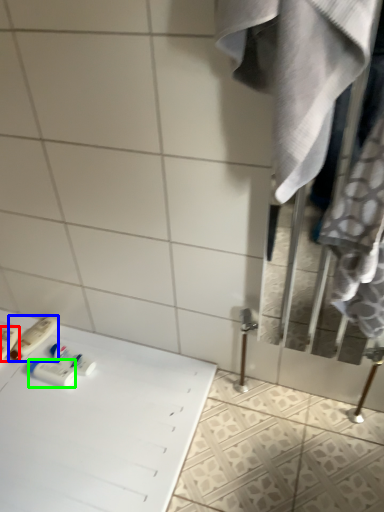
Question: Which object is the farthest from toiletry (highlighted by a red box)? Choose among these: toiletry (highlighted by a blue box) or toiletry (highlighted by a green box).

Choices:
 (A) toiletry
 (B) toiletry

Answer: (B)